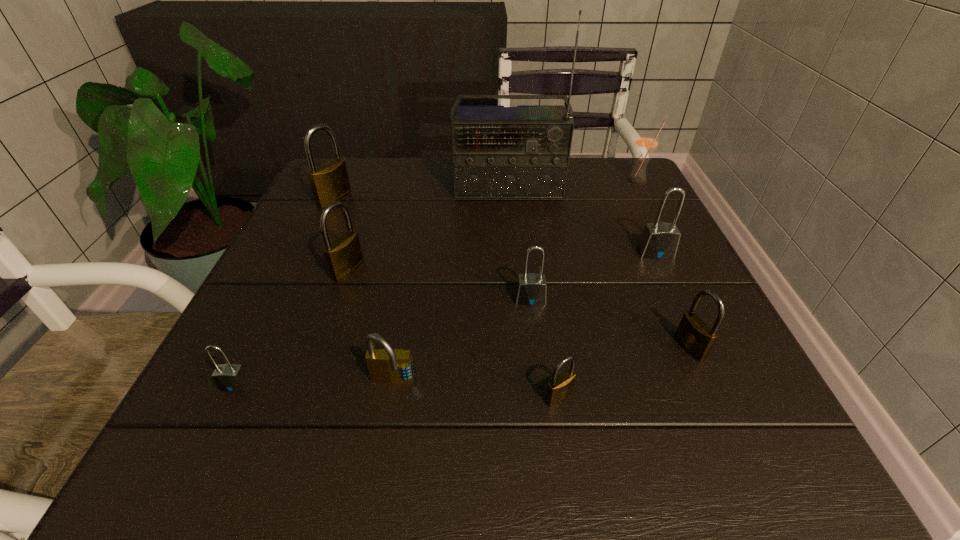
Locate which object is the third closest to the fourth padlock from left to right. Please provide its 2D coordinates. Your answer should be formatted as a tuple, i.e. [(x, y)], where the tuple contains the x and y coordinates of a point satisfying the conditions above.

[(343, 256)]

Image resolution: width=960 pixels, height=540 pixels. I want to click on padlock that is the nearest to the seventh object from right to left, so click(228, 377).

Select which padlock is the seventh closest to the second smallest brass padlock. Please provide its 2D coordinates. Your answer should be formatted as a tuple, i.e. [(x, y)], where the tuple contains the x and y coordinates of a point satisfying the conditions above.

[(329, 182)]

I want to click on brass padlock object that ranks as the closest to the leftmost gray padlock, so click(x=343, y=256).

Identify which brass padlock is the fourth closest to the smallest gray padlock. Please provide its 2D coordinates. Your answer should be formatted as a tuple, i.e. [(x, y)], where the tuple contains the x and y coordinates of a point satisfying the conditions above.

[(695, 336)]

Where is `gray padlock object that ranks as the second closest to the rightmost gray padlock`? The width and height of the screenshot is (960, 540). gray padlock object that ranks as the second closest to the rightmost gray padlock is located at coordinates (228, 377).

Find the location of a particular element. The height and width of the screenshot is (540, 960). gray padlock identified as the third closest to the straw is located at coordinates (228, 377).

Where is `vacant area that satisfies the following two spatial constraints: 1. on the shackle of the smallest brass padlock; 2. on the right side of the smallest gray padlock`? This screenshot has width=960, height=540. vacant area that satisfies the following two spatial constraints: 1. on the shackle of the smallest brass padlock; 2. on the right side of the smallest gray padlock is located at coordinates (229, 397).